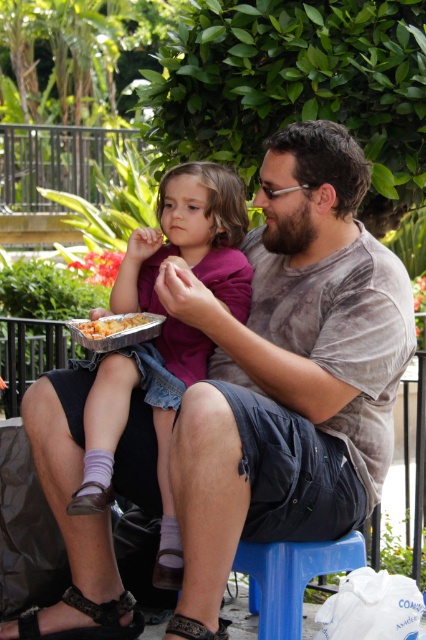
Looking at this image, does leather/black at lower left have a lesser height compared to leather sandal at lower center?

In fact, leather/black at lower left may be taller than leather sandal at lower center.

Is leather/black at lower left further to camera compared to leather sandal at lower center?

Yes, leather/black at lower left is behind leather sandal at lower center.

Is point (100, 611) less distant than point (219, 628)?

No, it is not.

Find the location of a particular element. The image size is (426, 640). leather/black at lower left is located at coordinates (89, 618).

Between purple matte shirt at center and golden crispy fries at center, which one is positioned higher?

golden crispy fries at center

Does purple matte shirt at center have a greater height compared to golden crispy fries at center?

Yes, purple matte shirt at center is taller than golden crispy fries at center.

Identify the location of purple matte shirt at center. The image size is (426, 640). (154, 426).

Find the location of `purple matte shirt at center`. purple matte shirt at center is located at coordinates (154, 426).

Consider the image. Can you confirm if leather/black at lower left is wider than golden crispy fries at center?

Indeed, leather/black at lower left has a greater width compared to golden crispy fries at center.

Between leather/black at lower left and golden crispy fries at center, which one appears on the left side from the viewer's perspective?

From the viewer's perspective, leather/black at lower left appears more on the left side.

What do you see at coordinates (89, 618) in the screenshot?
I see `leather/black at lower left` at bounding box center [89, 618].

You are a GUI agent. You are given a task and a screenshot of the screen. Output one action in this format:
    pyautogui.click(x=<x>, y=<y>)
    Task: Click on the leather/black at lower left
    The image size is (426, 640).
    Given the screenshot: What is the action you would take?
    pyautogui.click(x=89, y=618)